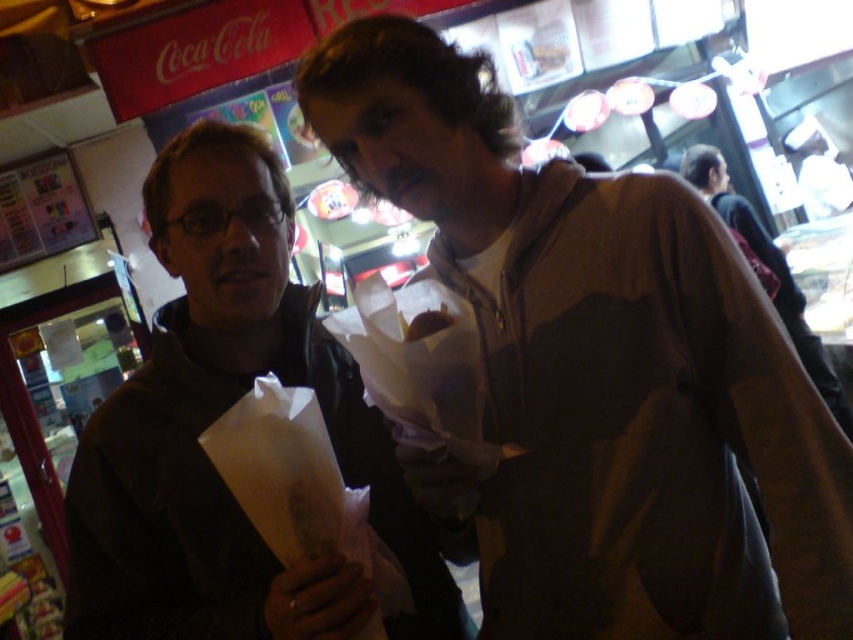
Can you confirm if dark brown jacket at center is bigger than brown leather jacket at right?

No.

Which is in front, point (334, 586) or point (722, 161)?

Point (334, 586) is in front.

Between point (140, 531) and point (791, 284), which one is positioned behind?

The point (791, 284) is more distant.

Locate an element on the screen. dark brown jacket at center is located at coordinates (215, 419).

Looking at this image, does matte brown jacket at center have a smaller size compared to brown leather jacket at right?

Yes, matte brown jacket at center is smaller than brown leather jacket at right.

Describe the element at coordinates (601, 368) in the screenshot. The width and height of the screenshot is (853, 640). I see `matte brown jacket at center` at that location.

Is point (619, 419) positioned after point (798, 292)?

No, it is not.

Identify the location of matte brown jacket at center. (601, 368).

Which is below, dark brown jacket at center or white paper bag at lower left?

white paper bag at lower left

This screenshot has width=853, height=640. Find the location of `dark brown jacket at center`. dark brown jacket at center is located at coordinates (215, 419).

Find the location of a particular element. This screenshot has height=640, width=853. dark brown jacket at center is located at coordinates (215, 419).